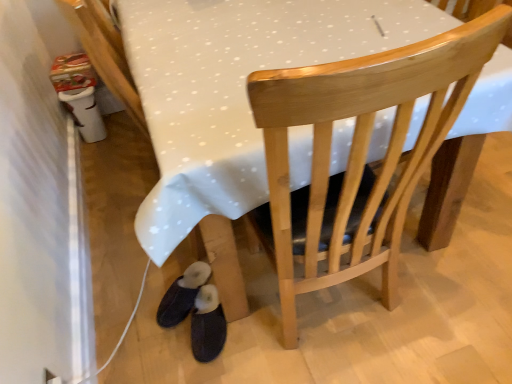
Locate an element on the screen. This screenshot has width=512, height=384. free space that is in between wooden chair at center and dark blue fabric slippers at lower left, marked as the 1th footwear in a right-to-left arrangement is located at coordinates (252, 338).